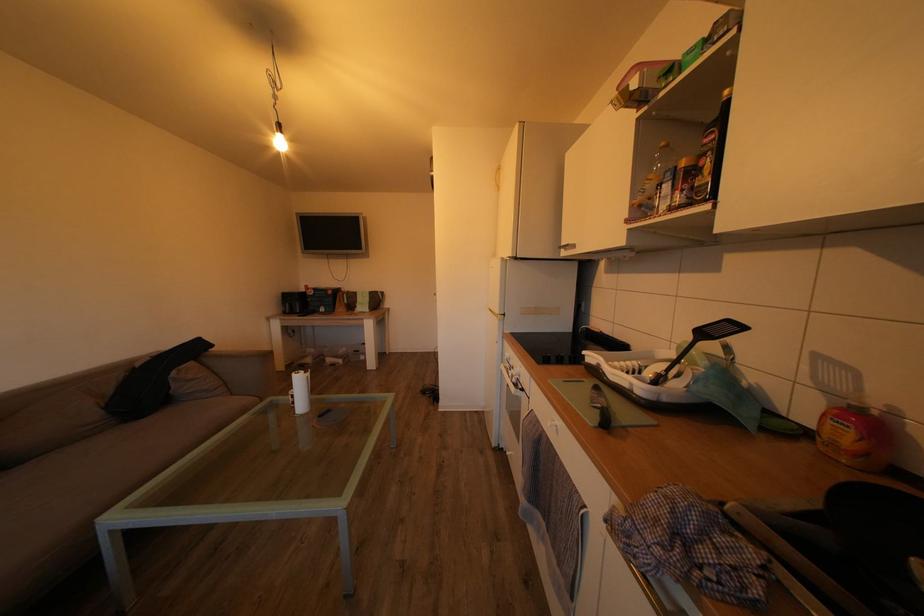
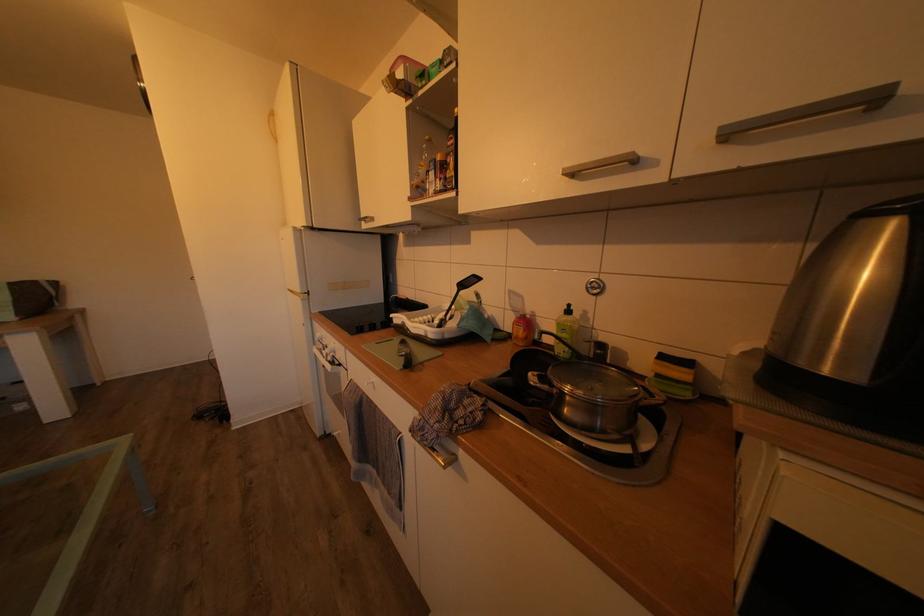
Where in the second image is the point corresponding to the point at 642,369 from the first image?

(436, 323)